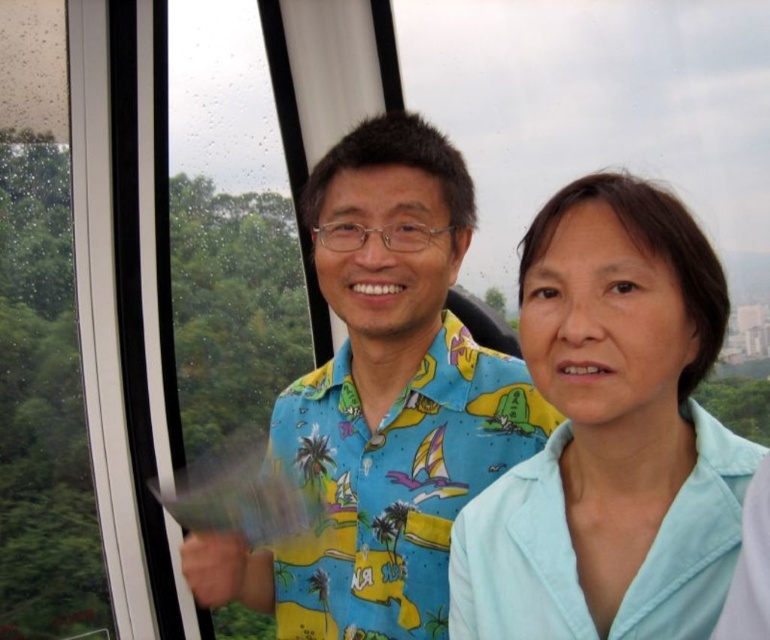
Question: Among these points, which one is farthest from the camera?

Choices:
 (A) (424, 515)
 (B) (496, 620)
 (C) (44, 401)

Answer: (C)

Question: Which of these objects is positioned farthest from the transparent glass window at left?

Choices:
 (A) printed fabric shirt at center
 (B) light blue fabric at center

Answer: (B)

Question: Can you confirm if light blue fabric at center is smaller than printed fabric shirt at center?

Choices:
 (A) yes
 (B) no

Answer: (A)

Question: Which point appears farthest from the camera in this image?

Choices:
 (A) (22, 513)
 (B) (571, 180)
 (C) (429, 392)

Answer: (A)

Question: Can you confirm if light blue fabric at center is positioned above transparent glass window at left?

Choices:
 (A) yes
 (B) no

Answer: (B)

Question: Is printed fabric shirt at center to the right of transparent glass window at left from the viewer's perspective?

Choices:
 (A) yes
 (B) no

Answer: (A)